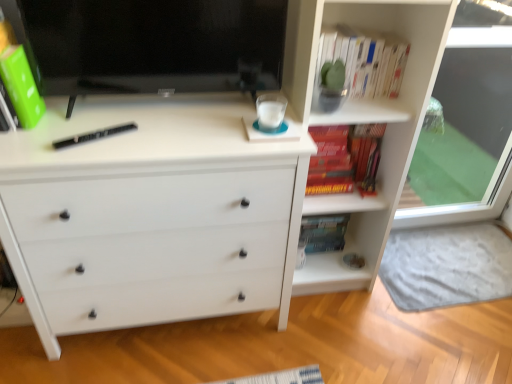
This screenshot has height=384, width=512. What are the coordinates of `vacant area that lies between black hardback book at center and green matte book at upper left, marked as the first paperback book in a top-to-bottom arrangement` in the screenshot? It's located at (65, 129).